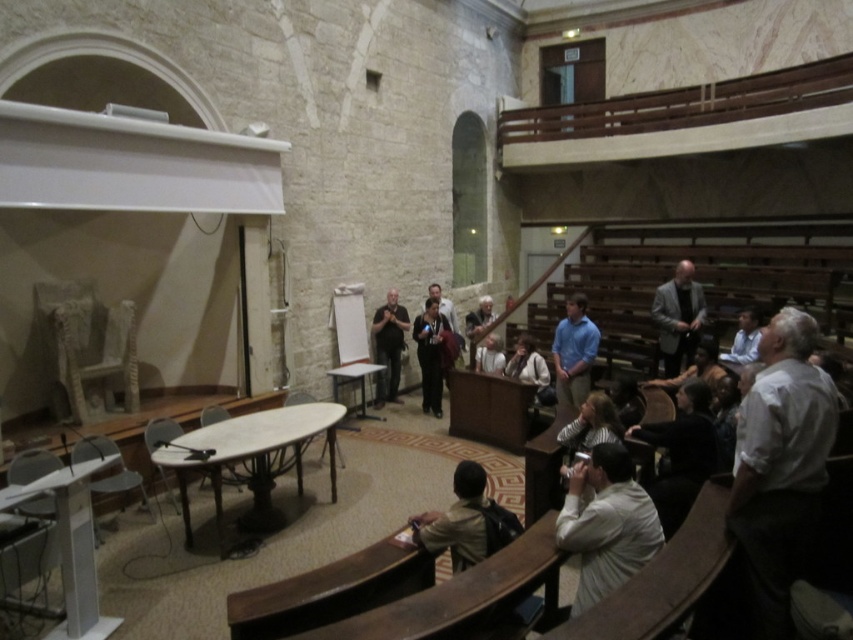
You are standing at the entrance of the lecture hall and see both the light brown leather jacket at lower center and the light brown wooden guitar at center. Which object is nearer to you?

The light brown leather jacket at lower center is closer to the viewer than the light brown wooden guitar at center, so the jacket is nearer to you.

You are a speaker preparing to give a presentation in this lecture hall. You need to walk from the dark gray suit at center to the dark gray shirt at center. Is the distance between them sufficient for you to comfortably walk through without needing to move any furniture?

The distance between the dark gray suit at center and the dark gray shirt at center is 3.05 meters, which is more than enough space for a person to comfortably walk through without needing to move any furniture.